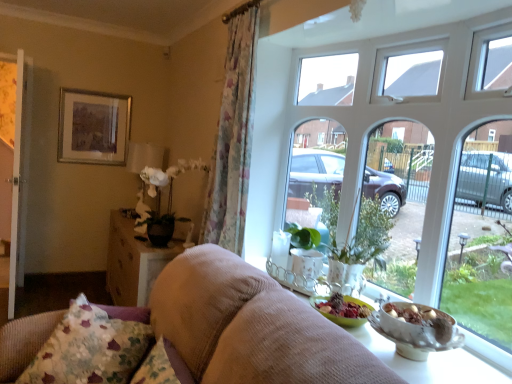
Locate an element on the screen. This screenshot has width=512, height=384. vacant area on top of silver metallic picture frame at upper left (from a real-world perspective) is located at coordinates (98, 86).